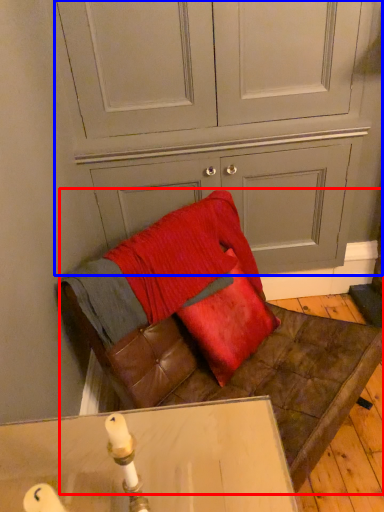
Question: Which of the following is the farthest to the observer, furniture (highlighted by a red box) or dresser (highlighted by a blue box)?

Choices:
 (A) furniture
 (B) dresser

Answer: (B)